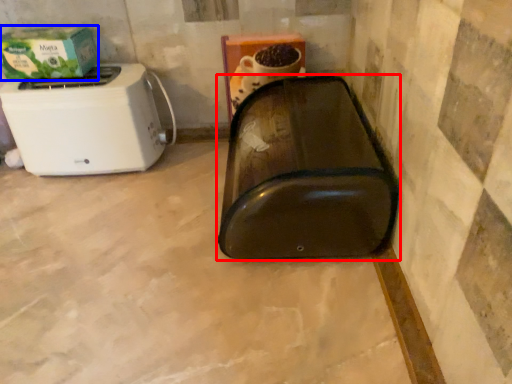
Question: Which object is closer to the camera taking this photo, appliance (highlighted by a red box) or box (highlighted by a blue box)?

Choices:
 (A) appliance
 (B) box

Answer: (A)